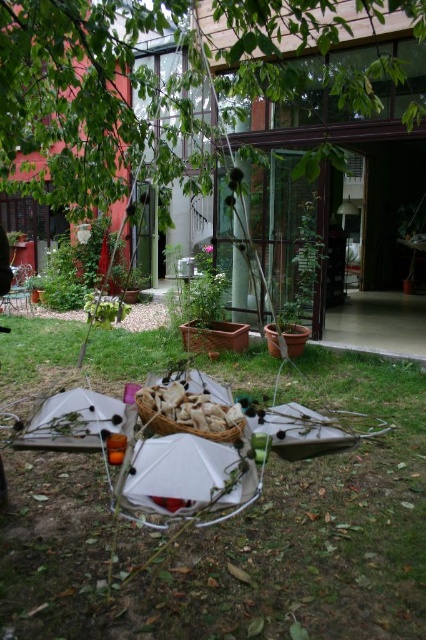
Question: Which of the following is the closest to the observer?

Choices:
 (A) green grass at center
 (B) green leafy tree at upper center

Answer: (B)

Question: Is green grass at center below white paper bag at center?

Choices:
 (A) yes
 (B) no

Answer: (A)

Question: Can you confirm if green grass at center is wider than white paper bag at center?

Choices:
 (A) no
 (B) yes

Answer: (B)

Question: From the image, what is the correct spatial relationship of green leafy tree at upper center in relation to white paper bag at center?

Choices:
 (A) right
 (B) left

Answer: (B)

Question: Which point is closer to the camera?

Choices:
 (A) (20, 380)
 (B) (195, 413)

Answer: (B)

Question: Estimate the real-world distances between objects in this image. Which object is closer to the white paper bag at center?

Choices:
 (A) green leafy tree at upper center
 (B) green grass at center

Answer: (B)